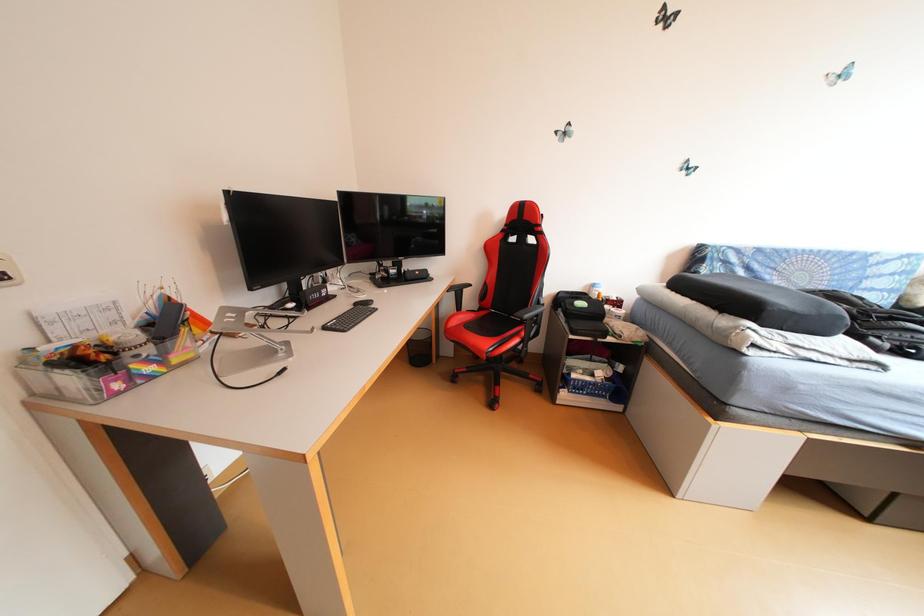
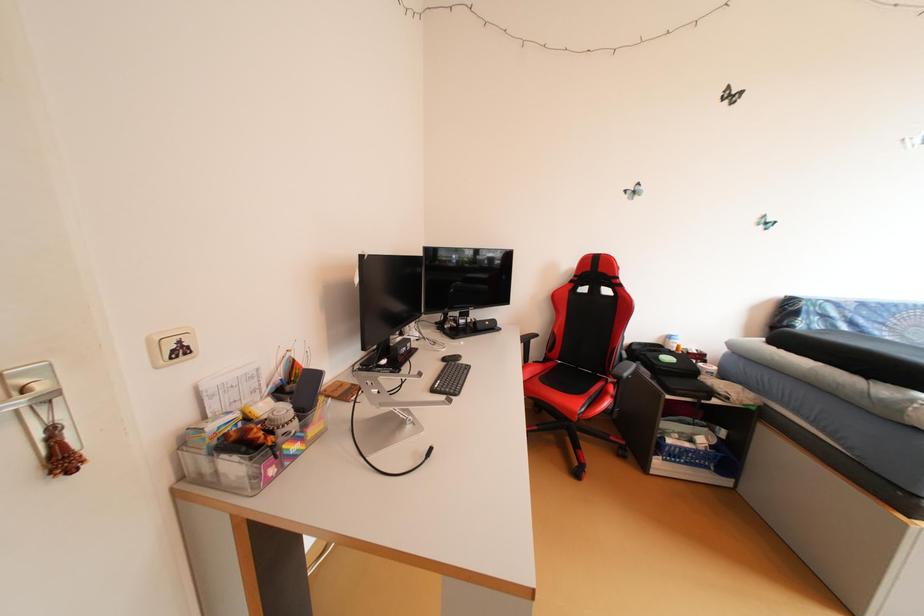
Question: What movement of the cameraman would produce the second image?

Choices:
 (A) Left
 (B) Right
 (C) Forward
 (D) Backward

Answer: (A)